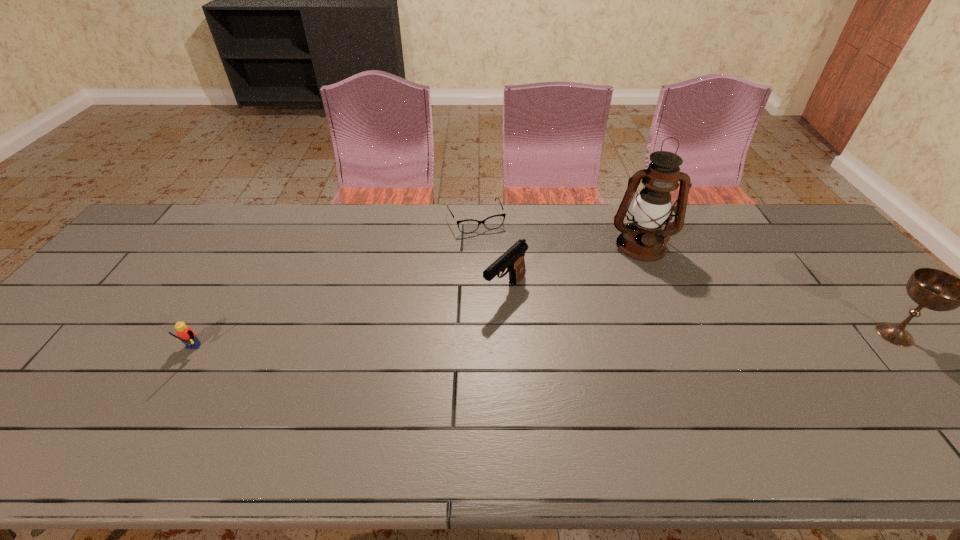
This screenshot has height=540, width=960. I want to click on vacant space on the desktop that is between the leftmost object and the second tallest object and is positioned on the side of the fourth object from left to right, there is a wick adjustment knob, so click(654, 341).

Locate an element on the screen. vacant space on the desktop that is between the leftmost object and the chalice and is positioned on the front-facing side of the shortest object is located at coordinates (532, 344).

Image resolution: width=960 pixels, height=540 pixels. In order to click on vacant space on the desktop that is between the leftmost object and the rightmost object and is positioned at the barrel of the third farthest object in this screenshot , I will do `click(446, 347)`.